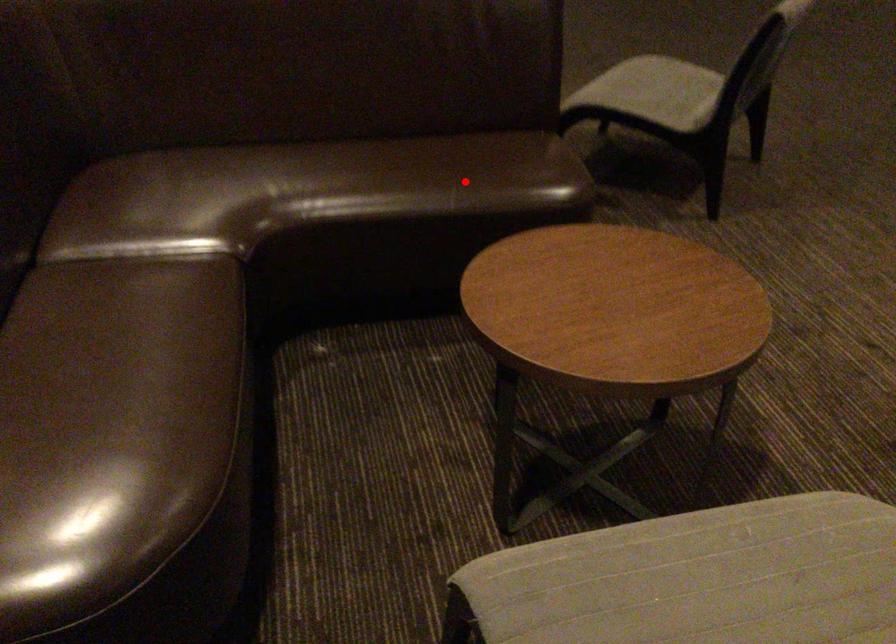
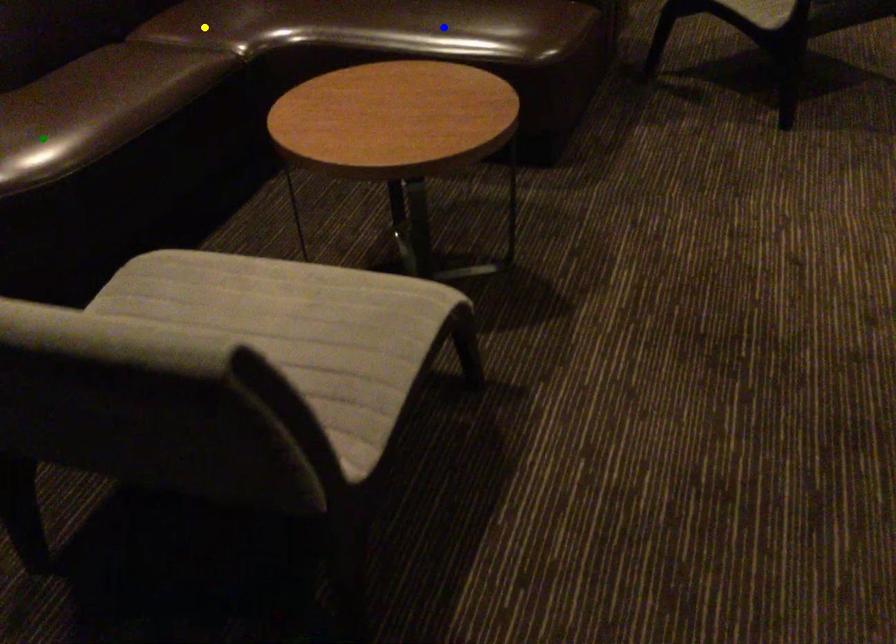
Question: I am providing you with two images of the same scene from different viewpoints. A red point is marked on the first image. You are given multiple points on the second image. Which point in image 2 is actually the same real-world point as the red point in image 1?

Choices:
 (A) blue point
 (B) yellow point
 (C) green point

Answer: (A)